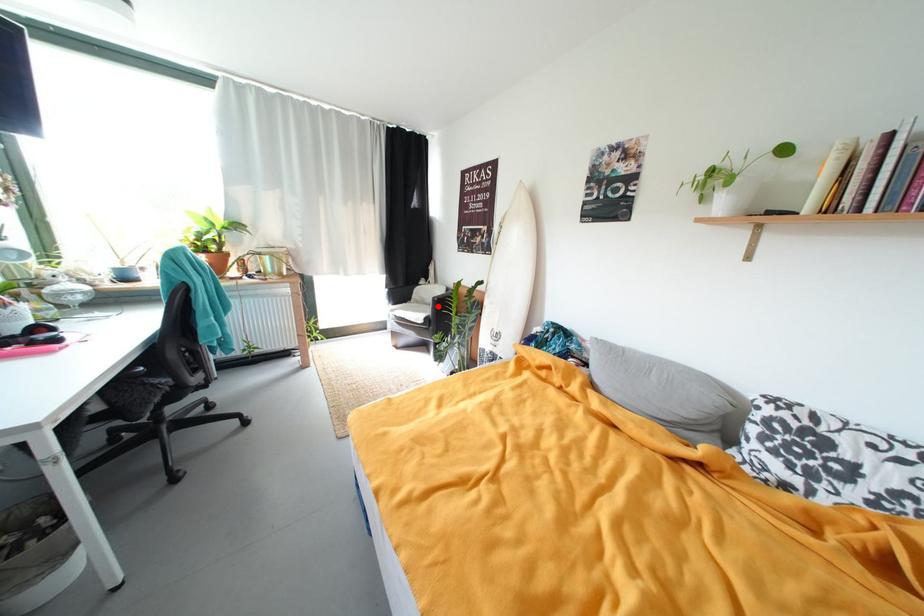
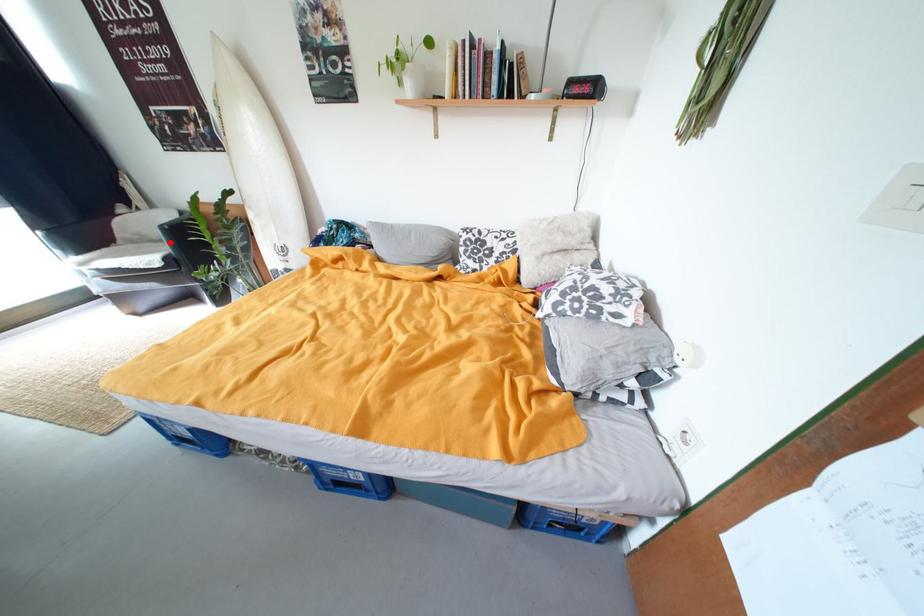
I am providing you with two images of the same scene from different viewpoints. A red point is marked on the first image and another point is marked on the second image. Do the highlighted points in image1 and image2 indicate the same real-world spot?

Yes